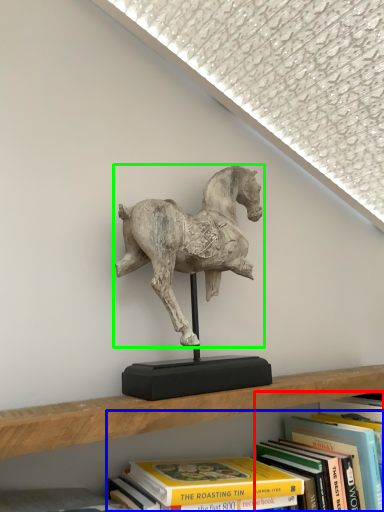
Question: Which object is positioned farthest from book (highlighted by a red box)? Select from book (highlighted by a blue box) and horse (highlighted by a green box).

Choices:
 (A) book
 (B) horse

Answer: (B)